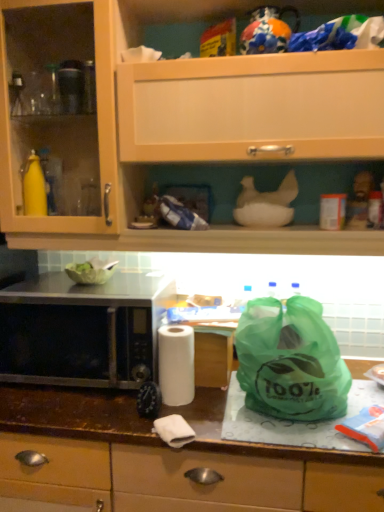
Question: Can you confirm if white matte paper towel at center is thinner than green plastic bag at right?

Choices:
 (A) no
 (B) yes

Answer: (B)

Question: Does white matte paper towel at center appear on the right side of green plastic bag at right?

Choices:
 (A) no
 (B) yes

Answer: (A)

Question: Considering the relative sizes of white matte paper towel at center and green plastic bag at right in the image provided, is white matte paper towel at center wider than green plastic bag at right?

Choices:
 (A) no
 (B) yes

Answer: (A)

Question: Does white matte paper towel at center turn towards green plastic bag at right?

Choices:
 (A) yes
 (B) no

Answer: (B)

Question: Considering the relative sizes of white matte paper towel at center and green plastic bag at right in the image provided, is white matte paper towel at center taller than green plastic bag at right?

Choices:
 (A) no
 (B) yes

Answer: (A)

Question: Is green plastic bag at right inside or outside of white matte paper towel at center?

Choices:
 (A) outside
 (B) inside

Answer: (A)

Question: In terms of size, does green plastic bag at right appear bigger or smaller than white matte paper towel at center?

Choices:
 (A) big
 (B) small

Answer: (A)

Question: Relative to white matte paper towel at center, is green plastic bag at right in front or behind?

Choices:
 (A) front
 (B) behind

Answer: (A)

Question: Visually, is green plastic bag at right positioned to the left or to the right of white matte paper towel at center?

Choices:
 (A) right
 (B) left

Answer: (A)

Question: Based on their positions, is black matte microwave at left located to the left or right of brown laminate countertop at center?

Choices:
 (A) left
 (B) right

Answer: (A)

Question: Considering the positions of black matte microwave at left and brown laminate countertop at center in the image, is black matte microwave at left taller or shorter than brown laminate countertop at center?

Choices:
 (A) tall
 (B) short

Answer: (B)

Question: Looking at the image, does black matte microwave at left seem bigger or smaller compared to brown laminate countertop at center?

Choices:
 (A) big
 (B) small

Answer: (B)

Question: Is black matte microwave at left situated inside brown laminate countertop at center or outside?

Choices:
 (A) outside
 (B) inside

Answer: (A)

Question: Would you say black matte microwave at left is to the left or to the right of white matte paper towel at center in the picture?

Choices:
 (A) left
 (B) right

Answer: (A)

Question: In the image, is black matte microwave at left positioned in front of or behind white matte paper towel at center?

Choices:
 (A) behind
 (B) front

Answer: (A)